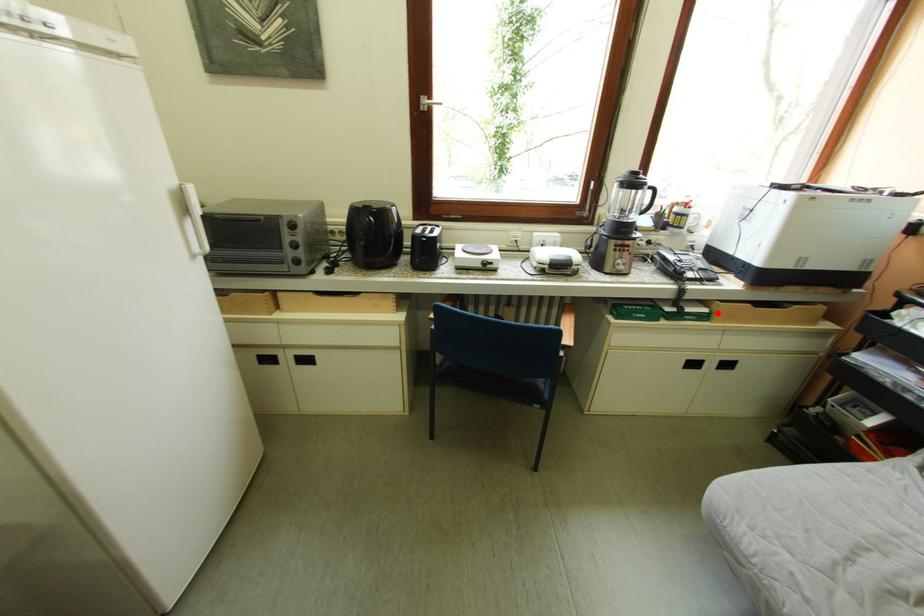
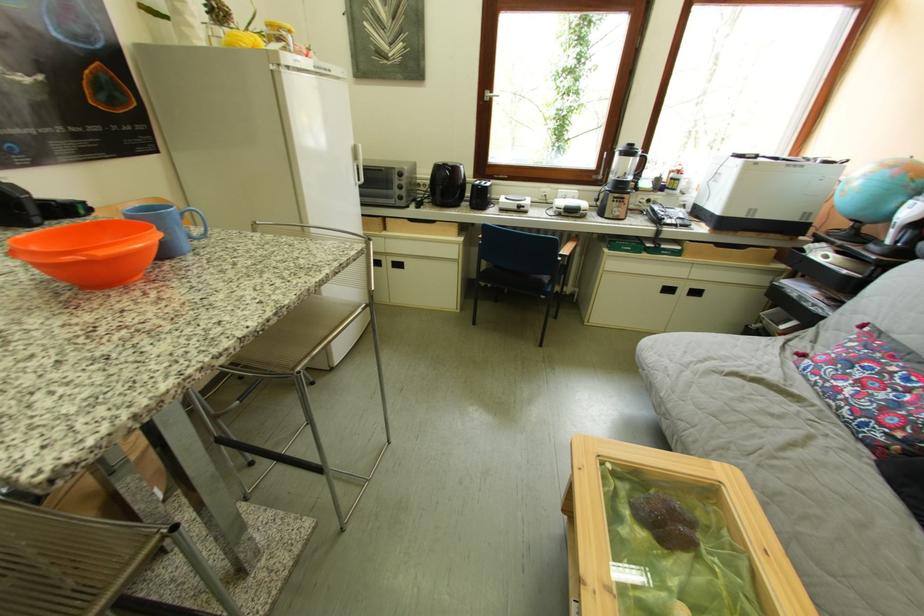
The point at the highlighted location is marked in the first image. Where is the corresponding point in the second image?

(690, 251)